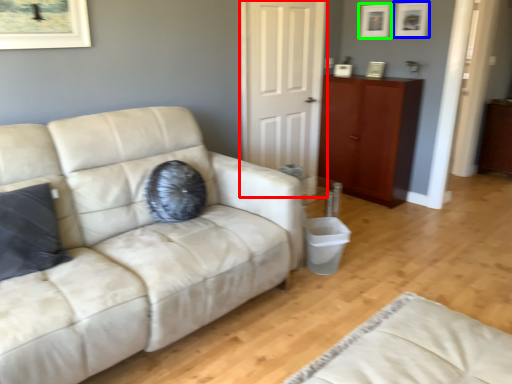
Question: Based on their relative distances, which object is nearer to door (highlighted by a red box)? Choose from picture frame (highlighted by a blue box) and picture frame (highlighted by a green box).

Choices:
 (A) picture frame
 (B) picture frame

Answer: (B)